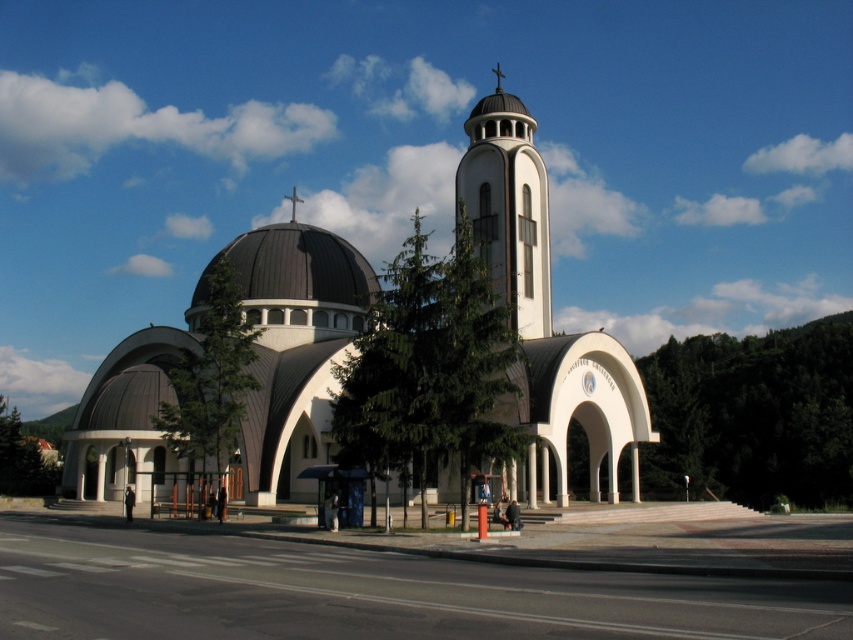
Is point (502, 161) farther from camera compared to point (323, 260)?

No, it is in front of (323, 260).

Does white smooth spire at center appear under black dome at center?

No.

Who is more distant from viewer, (x=535, y=300) or (x=317, y=296)?

The point (x=317, y=296) is behind.

Where is `white smooth spire at center`? This screenshot has height=640, width=853. white smooth spire at center is located at coordinates (508, 205).

From the picture: Who is positioned more to the right, white smooth church at center or white smooth spire at center?

white smooth spire at center is more to the right.

Between point (311, 241) and point (527, 164), which one is positioned behind?

The point (311, 241) is more distant.

Identify the location of white smooth church at center. (251, 365).

Does point (538, 157) lie behind point (328, 256)?

No, (538, 157) is closer to viewer.

Which is behind, point (508, 97) or point (276, 266)?

Point (508, 97)

Does point (280, 419) lie in front of point (267, 259)?

Yes, it is in front of point (267, 259).

Identify the location of white smooth church at center. (251, 365).